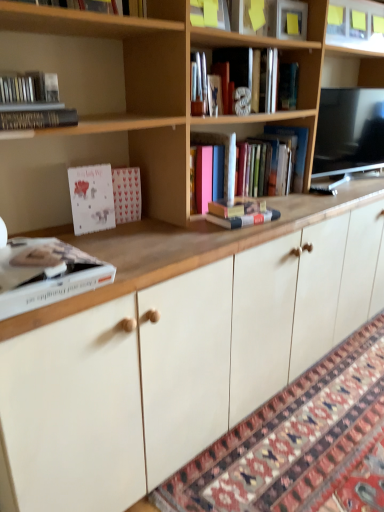
At what (x,y) coordinates should I click in order to perform the action: click on free spot to the right of hardcover book at center, which is the third book from right to left. Please return your answer as a coordinate pair (x, y). This screenshot has height=512, width=384. Looking at the image, I should click on (293, 211).